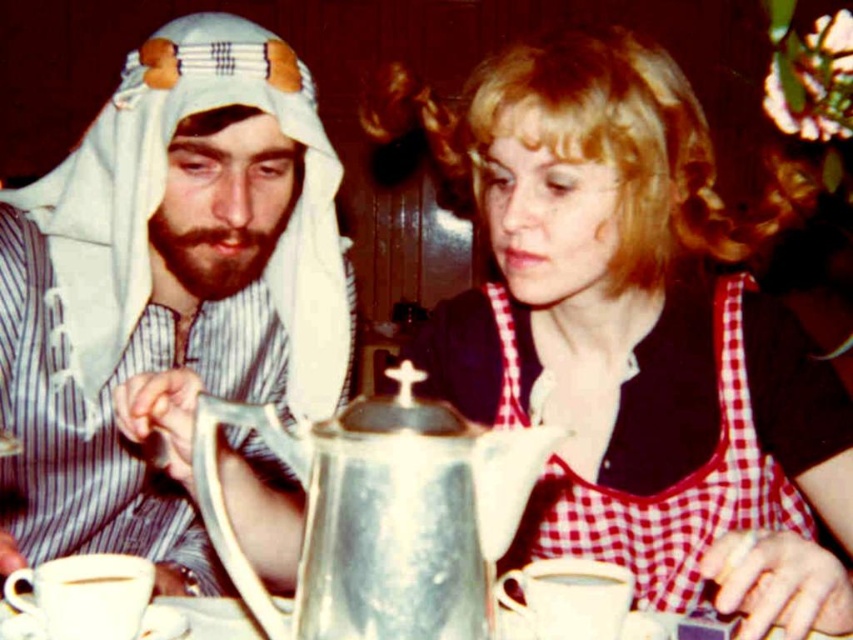
Question: Is matte white teapot at center wider than silver metallic teapot at center?

Choices:
 (A) yes
 (B) no

Answer: (A)

Question: Which point is farther to the camera?

Choices:
 (A) (518, 124)
 (B) (103, 413)
 (C) (321, 618)
 (D) (91, 573)

Answer: (B)

Question: Does matte white teapot at center have a smaller size compared to metallic silver coffee pot at center?

Choices:
 (A) yes
 (B) no

Answer: (B)

Question: Which is farther from the matte white teapot at center?

Choices:
 (A) silver metallic teapot at center
 (B) white matte headscarf at left
 (C) metallic silver coffee pot at center

Answer: (C)

Question: Which point is closer to the camera?

Choices:
 (A) (97, 573)
 (B) (39, 520)
 (C) (851, 442)
 (D) (386, 637)

Answer: (D)

Question: Is silver metallic teapot at center smaller than metallic silver coffee pot at center?

Choices:
 (A) no
 (B) yes

Answer: (A)